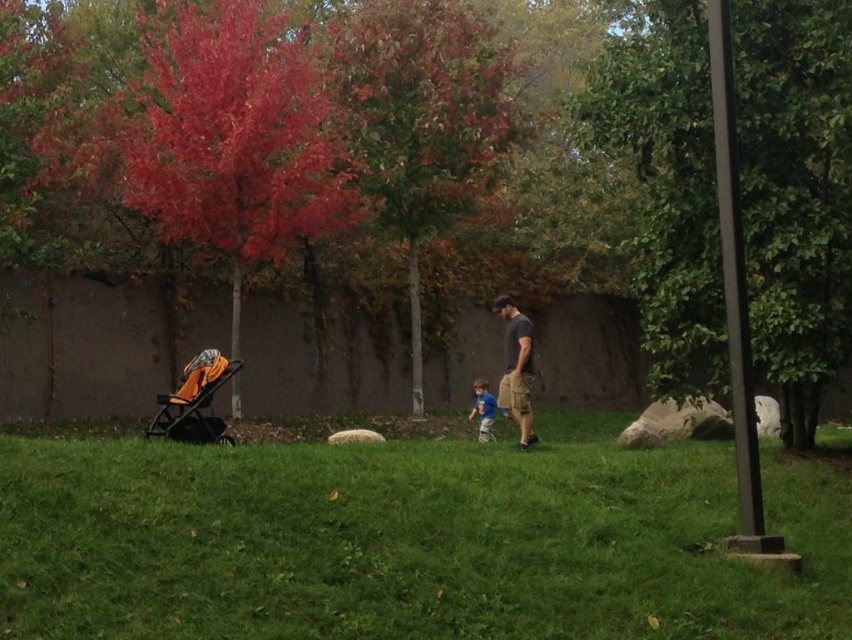
Consider the image. Between green grass at center and orange fabric baby carriage at lower left, which one has less height?

green grass at center is shorter.

Which is in front, point (117, 632) or point (204, 440)?

Point (117, 632) is more forward.

The height and width of the screenshot is (640, 852). Identify the location of green grass at center. (412, 540).

Who is positioned more to the right, red matte tree at upper left or orange fabric baby carriage at lower left?

From the viewer's perspective, red matte tree at upper left appears more on the right side.

Can you confirm if red matte tree at upper left is positioned to the right of orange fabric baby carriage at lower left?

Indeed, red matte tree at upper left is positioned on the right side of orange fabric baby carriage at lower left.

Describe the element at coordinates (372, 205) in the screenshot. This screenshot has height=640, width=852. I see `red matte tree at upper left` at that location.

Locate an element on the screen. The image size is (852, 640). red matte tree at upper left is located at coordinates (372, 205).

Is green leafy tree at right positioned behind orange fabric baby carriage at lower left?

No, it is in front of orange fabric baby carriage at lower left.

Which is behind, point (692, 168) or point (148, 422)?

The point (148, 422) is more distant.

Measure the distance between green leafy tree at right and camera.

8.20 meters

This screenshot has height=640, width=852. In order to click on green leafy tree at right in this screenshot , I will do `click(795, 195)`.